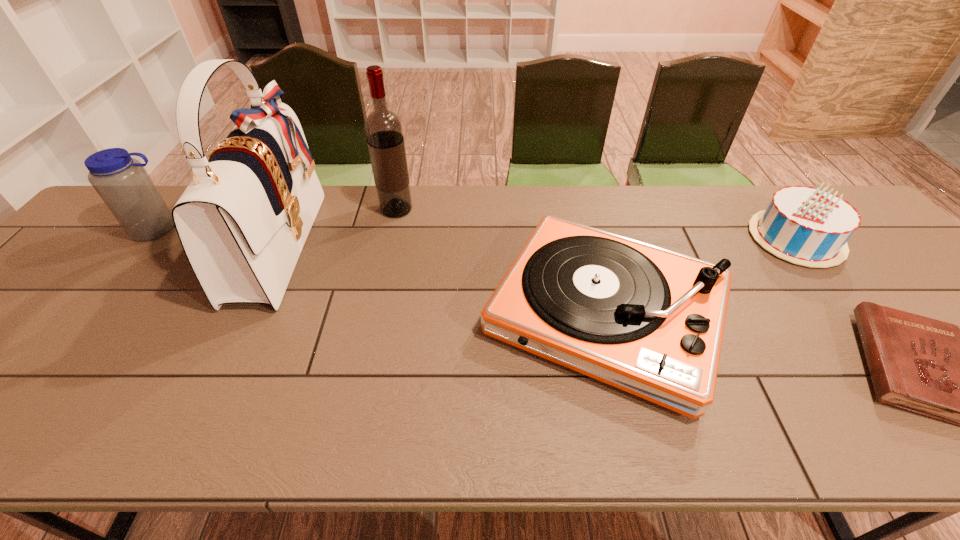
You are a GUI agent. You are given a task and a screenshot of the screen. Output one action in this format:
    pyautogui.click(x=<x>, y=<y>)
    Task: Click on the object at the far right corner
    The image size is (960, 540).
    Given the screenshot: What is the action you would take?
    pyautogui.click(x=806, y=226)

In the image, there is a desktop. At what (x,y) coordinates should I click in order to perform the action: click on vacant space at the far edge. Please return your answer as a coordinate pair (x, y). Image resolution: width=960 pixels, height=540 pixels. Looking at the image, I should click on (666, 198).

You are a GUI agent. You are given a task and a screenshot of the screen. Output one action in this format:
    pyautogui.click(x=<x>, y=<y>)
    Task: Click on the free space at the near edge of the desktop
    The height and width of the screenshot is (540, 960).
    Given the screenshot: What is the action you would take?
    pyautogui.click(x=177, y=423)

In the image, there is a desktop. Find the location of `free region at the left edge`. free region at the left edge is located at coordinates (105, 275).

This screenshot has width=960, height=540. What are the coordinates of `vacant point located between the record player and the leftmost object` in the screenshot? It's located at (382, 271).

What are the coordinates of `free area in between the birthday cake and the fourth object from right to left` in the screenshot? It's located at (596, 224).

This screenshot has width=960, height=540. I want to click on free space between the water bottle and the birthday cake, so click(x=477, y=234).

Image resolution: width=960 pixels, height=540 pixels. I want to click on free spot between the fifth object from right to left and the second tallest object, so click(x=338, y=227).

Identify the location of vacant point located between the birthday cake and the third object from left to right. (596, 224).

Select which object appears as the fourth closest to the fourth object from right to left. Please provide its 2D coordinates. Your answer should be formatted as a tuple, i.e. [(x, y)], where the tuple contains the x and y coordinates of a point satisfying the conditions above.

[(806, 226)]